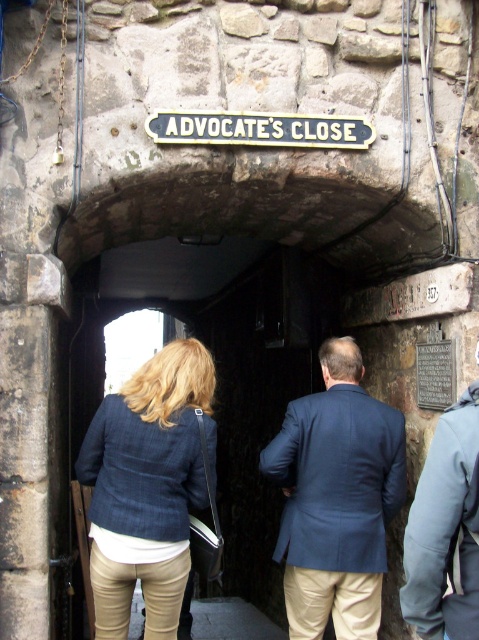
Is blue textured blazer at center to the left of metallic green sign at center from the viewer's perspective?

In fact, blue textured blazer at center is to the right of metallic green sign at center.

This screenshot has height=640, width=479. What are the coordinates of `blue textured blazer at center` in the screenshot? It's located at (394, 392).

Locate an element on the screen. blue textured blazer at center is located at coordinates (394, 392).

Between point (381, 531) and point (430, 476), which one is positioned behind?

The point (381, 531) is behind.

Where is `blue fabric jacket at center`? This screenshot has width=479, height=640. blue fabric jacket at center is located at coordinates pos(337,499).

Identify the location of blue fabric jacket at center. (337, 499).

Can you confirm if denim jacket at center is taller than metallic green sign at center?

Correct, denim jacket at center is much taller as metallic green sign at center.

Does point (149, 474) lie behind point (151, 116)?

That is False.

Does point (186, 435) come in front of point (284, 120)?

Yes, it is.

This screenshot has width=479, height=640. Find the location of `denim jacket at center`. denim jacket at center is located at coordinates (148, 486).